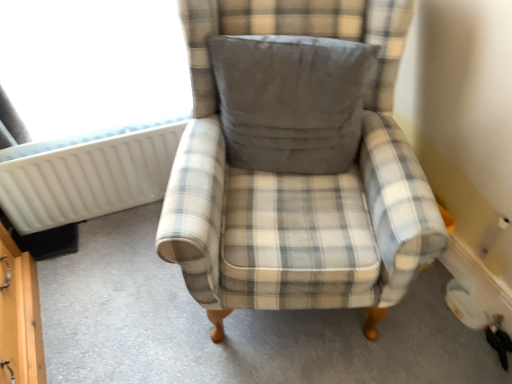
Question: Is transparent plastic radiator at upper left at the back of plaid fabric armchair at center?

Choices:
 (A) no
 (B) yes

Answer: (A)

Question: Considering the relative positions of plaid fabric armchair at center and transparent plastic radiator at upper left in the image provided, is plaid fabric armchair at center to the left of transparent plastic radiator at upper left from the viewer's perspective?

Choices:
 (A) no
 (B) yes

Answer: (A)

Question: Is plaid fabric armchair at center in contact with transparent plastic radiator at upper left?

Choices:
 (A) yes
 (B) no

Answer: (B)

Question: Is plaid fabric armchair at center shorter than transparent plastic radiator at upper left?

Choices:
 (A) no
 (B) yes

Answer: (A)

Question: Does plaid fabric armchair at center have a greater height compared to transparent plastic radiator at upper left?

Choices:
 (A) yes
 (B) no

Answer: (A)

Question: From the image's perspective, is plaid fabric armchair at center above transparent plastic radiator at upper left?

Choices:
 (A) no
 (B) yes

Answer: (A)

Question: Considering the relative sizes of white plastic radiator at left and transparent plastic radiator at upper left in the image provided, is white plastic radiator at left shorter than transparent plastic radiator at upper left?

Choices:
 (A) yes
 (B) no

Answer: (A)

Question: Is white plastic radiator at left thinner than transparent plastic radiator at upper left?

Choices:
 (A) no
 (B) yes

Answer: (B)

Question: Can you confirm if white plastic radiator at left is smaller than transparent plastic radiator at upper left?

Choices:
 (A) yes
 (B) no

Answer: (A)

Question: Is white plastic radiator at left facing away from transparent plastic radiator at upper left?

Choices:
 (A) no
 (B) yes

Answer: (A)

Question: From a real-world perspective, is white plastic radiator at left below transparent plastic radiator at upper left?

Choices:
 (A) yes
 (B) no

Answer: (A)

Question: Does white plastic radiator at left touch transparent plastic radiator at upper left?

Choices:
 (A) yes
 (B) no

Answer: (B)

Question: From a real-world perspective, is gray fabric pillow at center on transparent plastic radiator at upper left?

Choices:
 (A) yes
 (B) no

Answer: (B)